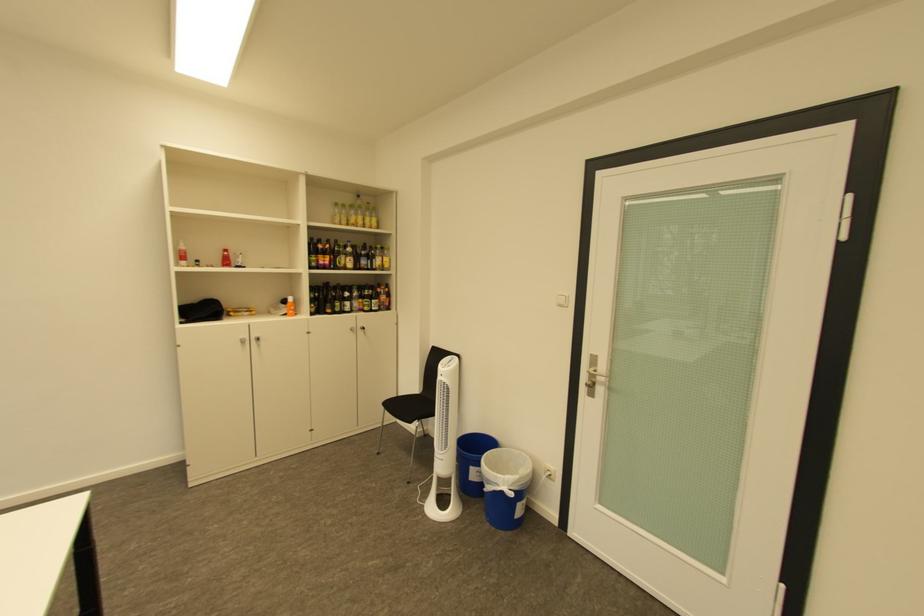
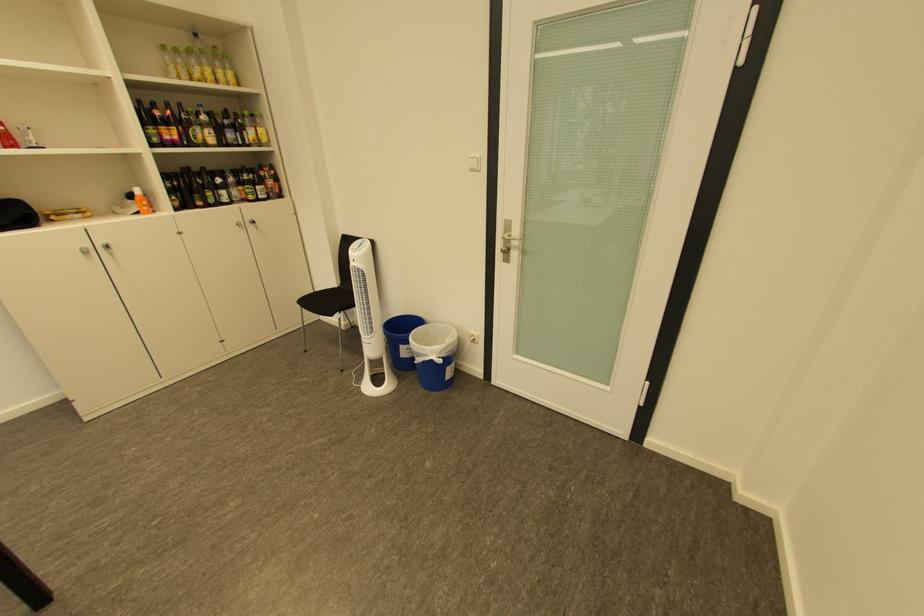
Find the pixel in the second image that matches (359,251) in the first image.

(213, 119)